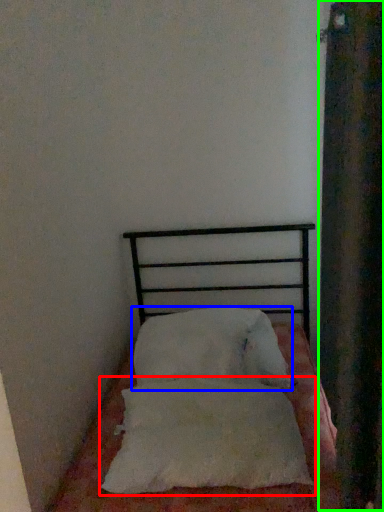
Question: Which object is the closest to the pillow (highlighted by a red box)? Choose among these: pillow (highlighted by a blue box) or curtain (highlighted by a green box).

Choices:
 (A) pillow
 (B) curtain

Answer: (A)